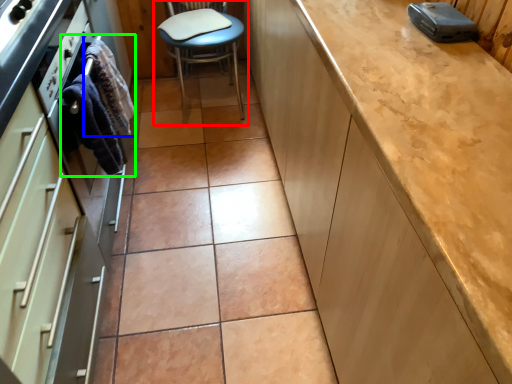
Question: Which object is positioned closest to chair (highlighted by a red box)? Select from material (highlighted by a blue box) and material (highlighted by a green box).

Choices:
 (A) material
 (B) material

Answer: (A)